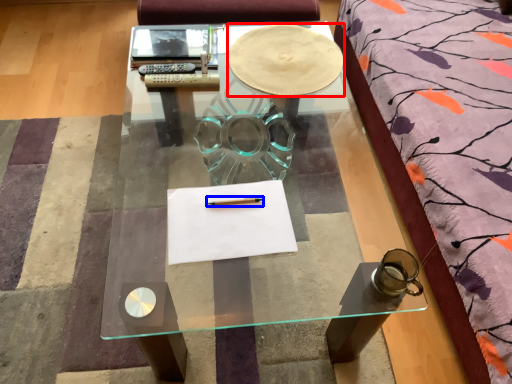
Question: Which object appears farthest to the camera in this image, round table (highlighted by a red box) or pencil (highlighted by a blue box)?

Choices:
 (A) round table
 (B) pencil

Answer: (A)